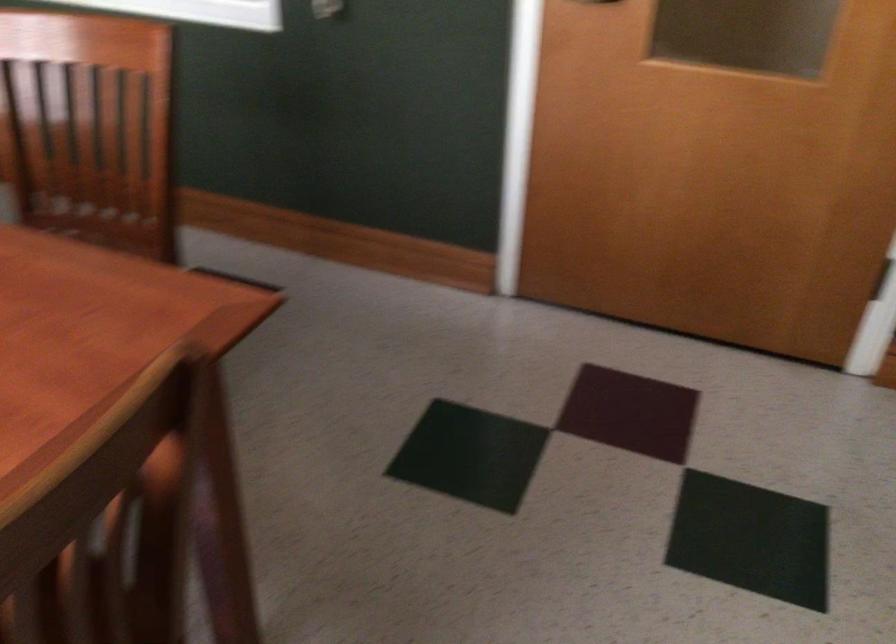
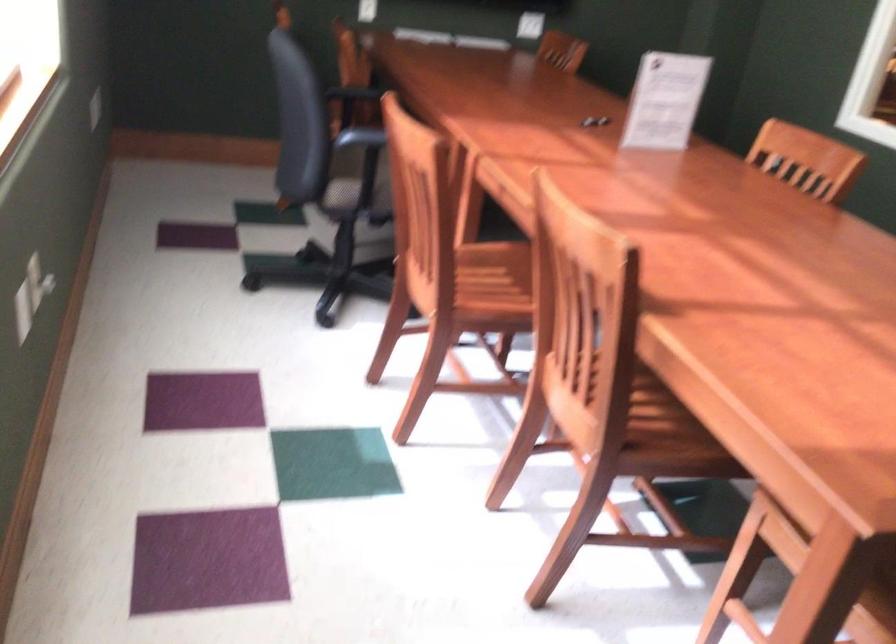
Question: The images are taken continuously from a first-person perspective. In which direction is your viewpoint rotating?

Choices:
 (A) Left
 (B) Right
 (C) Up
 (D) Down

Answer: (A)